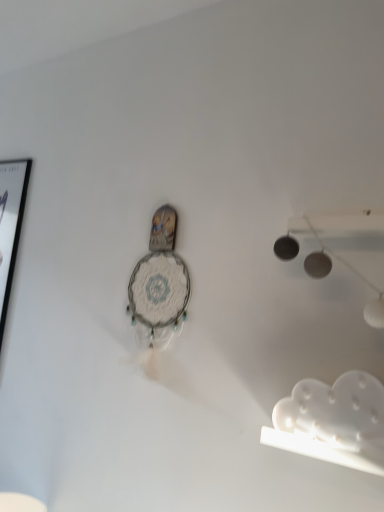
Question: Is white matte cloud at lower right surrounding white lace clock at center?

Choices:
 (A) no
 (B) yes

Answer: (A)

Question: Is white matte cloud at lower right taller than white lace clock at center?

Choices:
 (A) yes
 (B) no

Answer: (B)

Question: Is white matte cloud at lower right shorter than white lace clock at center?

Choices:
 (A) yes
 (B) no

Answer: (A)

Question: From the image's perspective, is white matte cloud at lower right on top of white lace clock at center?

Choices:
 (A) no
 (B) yes

Answer: (A)

Question: From a real-world perspective, is white matte cloud at lower right positioned under white lace clock at center based on gravity?

Choices:
 (A) no
 (B) yes

Answer: (B)

Question: Does white matte cloud at lower right have a greater width compared to white lace clock at center?

Choices:
 (A) yes
 (B) no

Answer: (B)

Question: Is white lace clock at center at the back of black glossy picture frame at left?

Choices:
 (A) yes
 (B) no

Answer: (B)

Question: Is black glossy picture frame at left touching white lace clock at center?

Choices:
 (A) yes
 (B) no

Answer: (B)

Question: From a real-world perspective, is black glossy picture frame at left positioned over white lace clock at center based on gravity?

Choices:
 (A) no
 (B) yes

Answer: (B)

Question: Could you tell me if black glossy picture frame at left is turned towards white lace clock at center?

Choices:
 (A) yes
 (B) no

Answer: (B)

Question: Is white lace clock at center located within black glossy picture frame at left?

Choices:
 (A) yes
 (B) no

Answer: (B)

Question: Does black glossy picture frame at left have a lesser height compared to white lace clock at center?

Choices:
 (A) no
 (B) yes

Answer: (A)

Question: Considering the relative sizes of white lace clock at center and white matte cloud at lower right in the image provided, is white lace clock at center taller than white matte cloud at lower right?

Choices:
 (A) no
 (B) yes

Answer: (B)